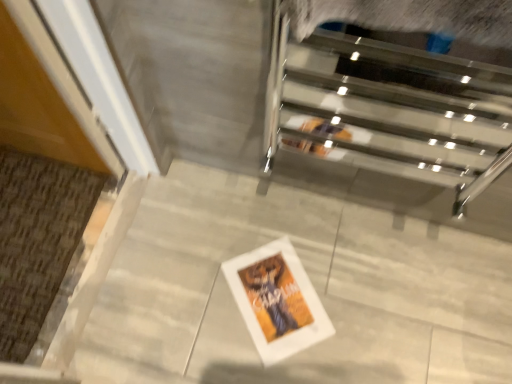
What are the coordinates of `free space above white matte picture frame at center (from a real-world perspective)` in the screenshot? It's located at (272, 297).